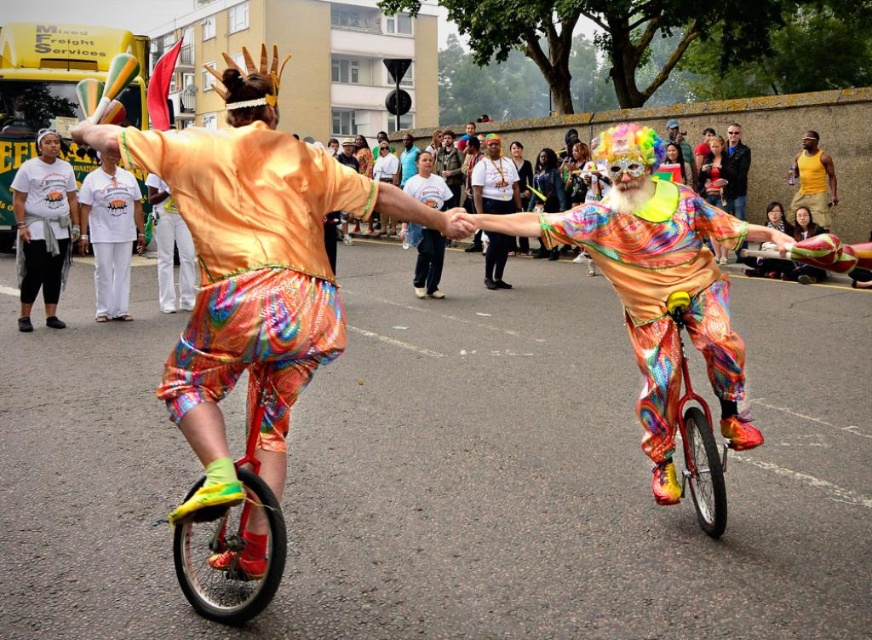
Question: Based on their relative distances, which object is nearer to the red matte unicycle at center?

Choices:
 (A) white t-shirt at left
 (B) white cotton shirt at center

Answer: (A)

Question: Observing the image, what is the correct spatial positioning of red matte unicycle at center in reference to white t-shirt at left?

Choices:
 (A) below
 (B) above

Answer: (A)

Question: Is red matte unicycle at center smaller than white cotton shirt at center?

Choices:
 (A) yes
 (B) no

Answer: (A)

Question: Which of the following is the farthest from the observer?

Choices:
 (A) (18, 168)
 (B) (696, 465)
 (C) (276, 547)
 (D) (128, 314)

Answer: (A)

Question: Is white cotton shirt at center behind red metallic unicycle at center?

Choices:
 (A) yes
 (B) no

Answer: (A)

Question: Estimate the real-world distances between objects in this image. Which object is closer to the red matte unicycle at center?

Choices:
 (A) white t-shirt at left
 (B) red metallic unicycle at center
 (C) white cotton shirt at center

Answer: (B)